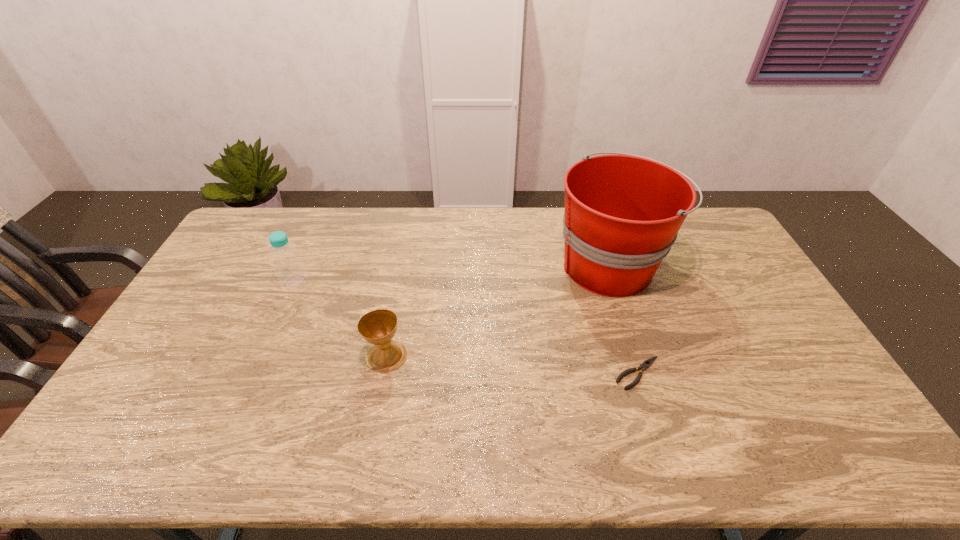
This screenshot has width=960, height=540. I want to click on object that is at the far edge, so click(x=623, y=212).

Image resolution: width=960 pixels, height=540 pixels. In order to click on vacant region at the far edge of the desktop in this screenshot , I will do `click(302, 220)`.

Image resolution: width=960 pixels, height=540 pixels. I want to click on vacant space at the near edge of the desktop, so click(511, 446).

At what (x,y) coordinates should I click in order to perform the action: click on vacant area at the left edge. Please return your answer as a coordinate pair (x, y). This screenshot has height=540, width=960. Looking at the image, I should click on (226, 262).

In the image, there is a desktop. Identify the location of vacant space at the right edge. (754, 304).

This screenshot has width=960, height=540. I want to click on vacant space at the far right corner of the desktop, so click(x=700, y=238).

The image size is (960, 540). Find the location of `vacant area that lies between the third tallest object and the bottle`. vacant area that lies between the third tallest object and the bottle is located at coordinates (341, 319).

Identify the location of free spot between the shortest object and the bottle. (467, 328).

Locate an element on the screen. This screenshot has height=540, width=960. free spot between the shortest object and the tallest object is located at coordinates (624, 319).

Identify the location of vacant point located between the chalice and the second tallest object. (341, 319).